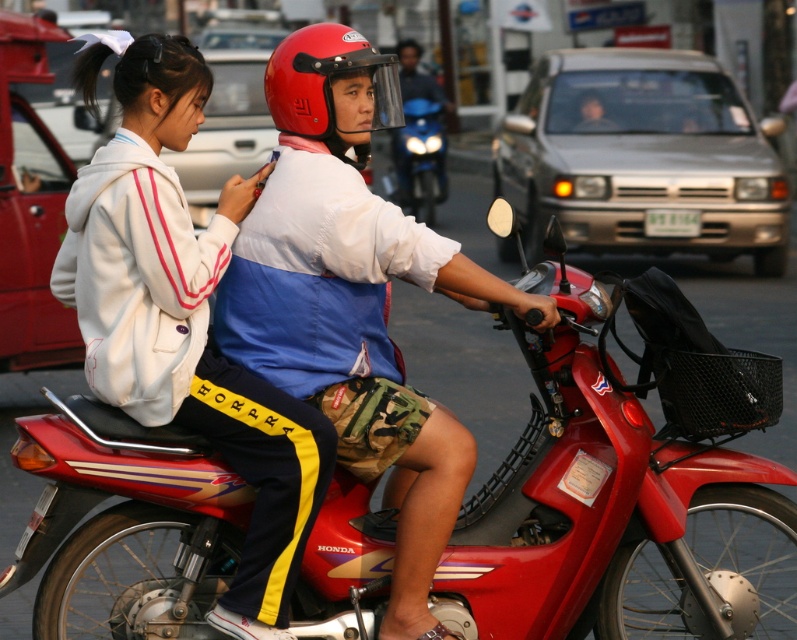
Who is taller, white fleece jacket at upper left or red matte helmet at center?

Standing taller between the two is white fleece jacket at upper left.

Which is more to the left, white fleece jacket at upper left or red matte helmet at center?

From the viewer's perspective, white fleece jacket at upper left appears more on the left side.

In order to click on white fleece jacket at upper left in this screenshot , I will do `click(183, 316)`.

Is matte blue shirt at center smaller than metallic red motorcycle at center?

Yes, matte blue shirt at center is smaller than metallic red motorcycle at center.

Who is shorter, matte blue shirt at center or metallic red motorcycle at center?

Standing shorter between the two is matte blue shirt at center.

Does point (407, 461) lie behind point (477, 385)?

No, it is in front of (477, 385).

Locate an element on the screen. matte blue shirt at center is located at coordinates (352, 298).

What do you see at coordinates (464, 369) in the screenshot? The width and height of the screenshot is (797, 640). I see `metallic red motorcycle at center` at bounding box center [464, 369].

Is point (684, 282) positioned after point (301, 100)?

Yes, point (684, 282) is behind point (301, 100).

Locate an element on the screen. This screenshot has width=797, height=640. metallic red motorcycle at center is located at coordinates (464, 369).